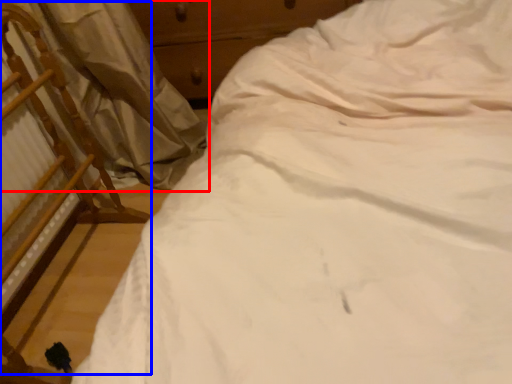
Question: Which object is further to the camera taking this photo, curtain (highlighted by a red box) or chair (highlighted by a blue box)?

Choices:
 (A) curtain
 (B) chair

Answer: (A)